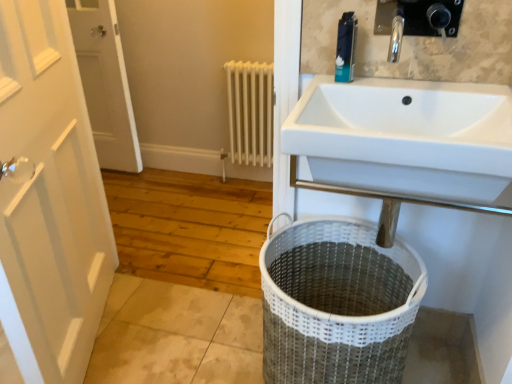
Question: Can you confirm if white wooden door at left, marked as the 2th door in a right-to-left arrangement, is bigger than white metal radiator at center?

Choices:
 (A) no
 (B) yes

Answer: (B)

Question: Is white wooden door at left, which is counted as the second door, starting from the front, thinner than white metal radiator at center?

Choices:
 (A) no
 (B) yes

Answer: (B)

Question: Is white wooden door at left, placed as the first door when sorted from back to front, at the right side of white metal radiator at center?

Choices:
 (A) no
 (B) yes

Answer: (A)

Question: Is white wooden door at left, marked as the 2th door in a right-to-left arrangement, outside white metal radiator at center?

Choices:
 (A) no
 (B) yes

Answer: (B)

Question: Considering the relative sizes of white wooden door at left, placed as the first door when sorted from back to front, and white metal radiator at center in the image provided, is white wooden door at left, placed as the first door when sorted from back to front, shorter than white metal radiator at center?

Choices:
 (A) yes
 (B) no

Answer: (B)

Question: Can you confirm if white wooden door at left, the first door in the left-to-right sequence, is smaller than white metal radiator at center?

Choices:
 (A) no
 (B) yes

Answer: (A)

Question: Considering the relative positions of white metal radiator at center and white wooden door at left, placed as the 1th door when sorted from front to back, in the image provided, is white metal radiator at center to the right of white wooden door at left, placed as the 1th door when sorted from front to back, from the viewer's perspective?

Choices:
 (A) yes
 (B) no

Answer: (A)

Question: Is white metal radiator at center not close to white wooden door at left, arranged as the 2th door when viewed from the left?

Choices:
 (A) no
 (B) yes

Answer: (B)

Question: Can you confirm if white metal radiator at center is bigger than white wooden door at left, placed as the 1th door when sorted from front to back?

Choices:
 (A) yes
 (B) no

Answer: (B)

Question: From the image's perspective, is white metal radiator at center over white wooden door at left, the second door in the back-to-front sequence?

Choices:
 (A) yes
 (B) no

Answer: (A)

Question: From a real-world perspective, does white metal radiator at center stand above white wooden door at left, the second door in the back-to-front sequence?

Choices:
 (A) yes
 (B) no

Answer: (B)

Question: Is white metal radiator at center with white wooden door at left, the second door in the back-to-front sequence?

Choices:
 (A) yes
 (B) no

Answer: (B)

Question: Can we say blue plastic toothpaste tube at upper center lies outside white wooden door at left, arranged as the 2th door when viewed from the left?

Choices:
 (A) yes
 (B) no

Answer: (A)